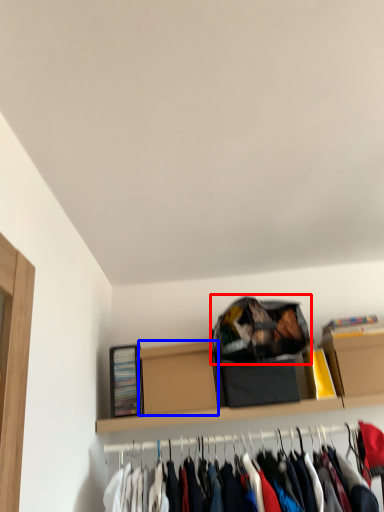
Question: Which point is further to the camera, bag (highlighted by a red box) or cardboard box (highlighted by a blue box)?

Choices:
 (A) bag
 (B) cardboard box

Answer: (B)